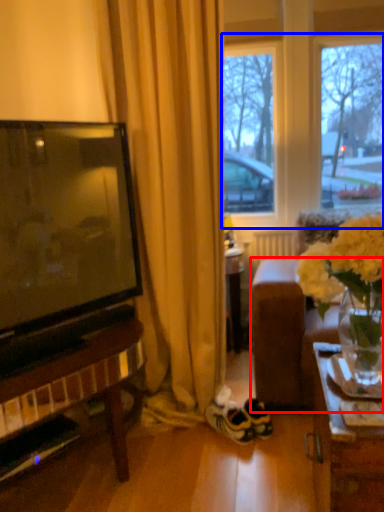
Question: Which of the following is the closest to the observer, studio couch (highlighted by a red box) or window frame (highlighted by a blue box)?

Choices:
 (A) studio couch
 (B) window frame

Answer: (A)